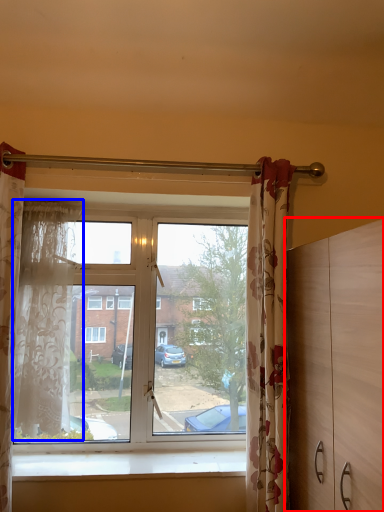
Question: Which point is closer to the camera, dresser (highlighted by a red box) or curtain (highlighted by a blue box)?

Choices:
 (A) dresser
 (B) curtain

Answer: (A)